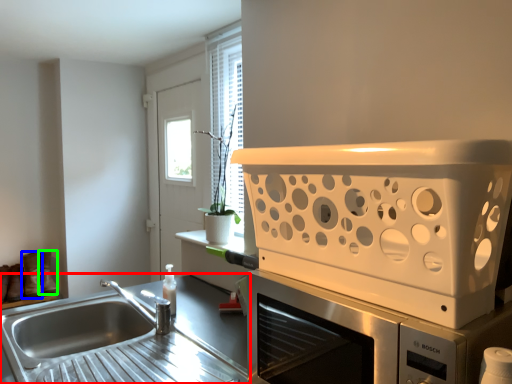
Question: Which object is the closest to the countertop (highlighted by a red box)? Choose among these: shoe (highlighted by a blue box) or boot (highlighted by a green box).

Choices:
 (A) shoe
 (B) boot

Answer: (A)